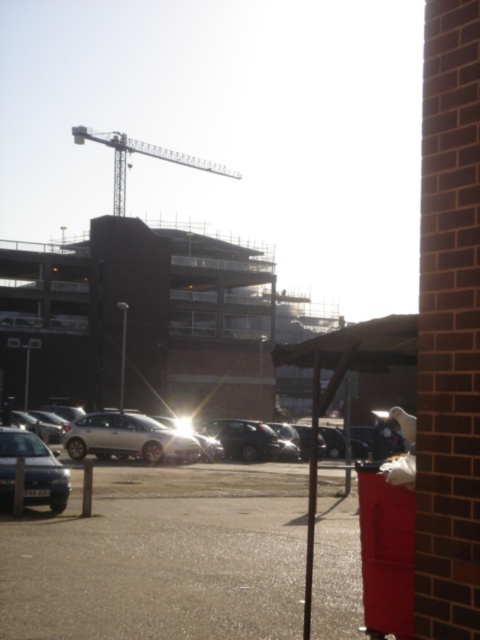
You are a delivery person needing to park your vehicle in a tight space between two cars. The space is exactly the width of the shiny silver sedan at lower left. Can you safely park your satin silver car at center in this space?

The satin silver car at center is wider than the shiny silver sedan at lower left, so it cannot fit into the space which is only as wide as the shiny silver sedan at lower left.

You are a delivery person trying to park your van between the shiny silver sedan at lower left and the metallic pole at center. Based on the space they occupy, can you fit your van there?

The shiny silver sedan at lower left occupies less space than the metallic pole at center, so the space between them may be sufficient for your van. However, since the sedan takes up less area, the exact available space depends on their positioning. Check the distance between them before attempting to park.

You are standing in the urban scene and want to place a small marker at both point (317, 588) and point (314, 480). Which point will have its marker appear larger in the photo?

Point (317, 588) is closer to the camera than point (314, 480), so the marker at point (317, 588) will appear larger in the photo.